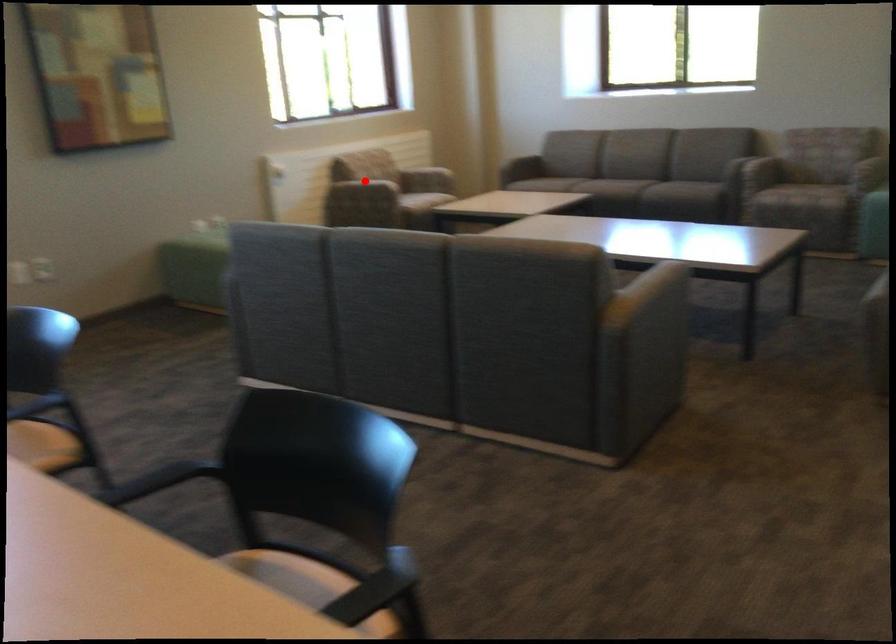
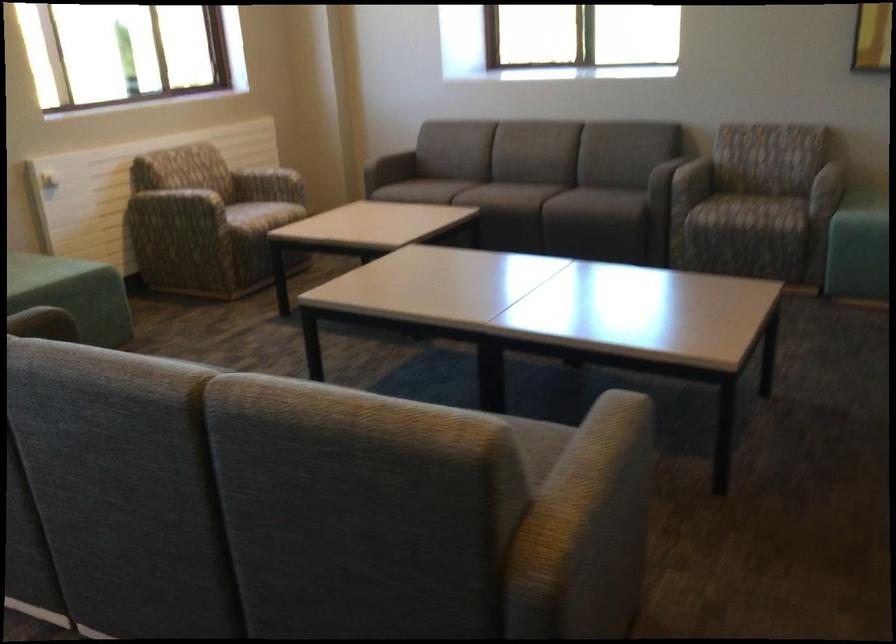
Question: A red point is marked in image1. In image2, is the corresponding 3D point closer to the camera or farther? Reply with the corresponding letter.

Choices:
 (A) The corresponding 3D point is closer.
 (B) The corresponding 3D point is farther.

Answer: (A)